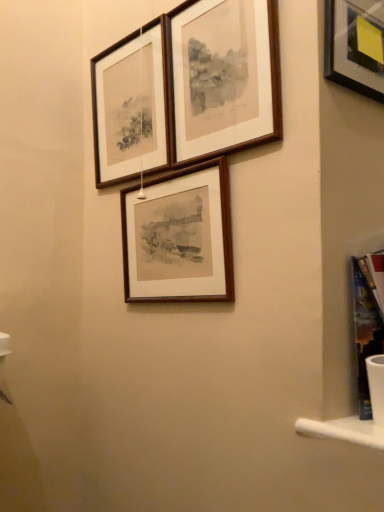
Question: Considering the relative sizes of wooden frame at center, the 3th picture frame positioned from the top, and wooden frame at upper center, which appears as the 1th picture frame when viewed from the top, in the image provided, is wooden frame at center, the 3th picture frame positioned from the top, wider than wooden frame at upper center, which appears as the 1th picture frame when viewed from the top,?

Choices:
 (A) no
 (B) yes

Answer: (B)

Question: From the image's perspective, is wooden frame at center, which is the 1th picture frame in bottom-to-top order, below wooden frame at upper center, which appears as the 1th picture frame when viewed from the top?

Choices:
 (A) yes
 (B) no

Answer: (A)

Question: Can you confirm if wooden frame at center, the 3th picture frame positioned from the top, is bigger than wooden frame at upper center, arranged as the third picture frame when ordered from the bottom?

Choices:
 (A) yes
 (B) no

Answer: (A)

Question: Is wooden frame at center, which is the 1th picture frame in bottom-to-top order, far away from wooden frame at upper center, which appears as the 1th picture frame when viewed from the top?

Choices:
 (A) no
 (B) yes

Answer: (A)

Question: Would you say wooden frame at upper center, which appears as the 1th picture frame when viewed from the top, is part of wooden frame at center, the 3th picture frame positioned from the top,'s contents?

Choices:
 (A) yes
 (B) no

Answer: (B)

Question: From a real-world perspective, is wooden frame at upper center, the 2th picture frame from the bottom, physically located above or below wooden frame at center, which is the 1th picture frame in bottom-to-top order?

Choices:
 (A) above
 (B) below

Answer: (A)

Question: Which is correct: wooden frame at upper center, the 2th picture frame when ordered from top to bottom, is inside wooden frame at center, the 3th picture frame positioned from the top, or outside of it?

Choices:
 (A) outside
 (B) inside

Answer: (A)

Question: Considering the positions of wooden frame at upper center, the 2th picture frame when ordered from top to bottom, and wooden frame at center, the 3th picture frame positioned from the top, in the image, is wooden frame at upper center, the 2th picture frame when ordered from top to bottom, bigger or smaller than wooden frame at center, the 3th picture frame positioned from the top,?

Choices:
 (A) small
 (B) big

Answer: (B)

Question: Considering the relative positions of wooden frame at upper center, the 2th picture frame when ordered from top to bottom, and wooden frame at center, which is the 1th picture frame in bottom-to-top order, in the image provided, is wooden frame at upper center, the 2th picture frame when ordered from top to bottom, to the left or to the right of wooden frame at center, which is the 1th picture frame in bottom-to-top order,?

Choices:
 (A) right
 (B) left

Answer: (B)

Question: Considering their positions, is wooden frame at upper center, arranged as the third picture frame when ordered from the bottom, located in front of or behind wooden frame at center, the 3th picture frame positioned from the top?

Choices:
 (A) behind
 (B) front

Answer: (B)

Question: In the image, is wooden frame at upper center, which appears as the 1th picture frame when viewed from the top, on the left side or the right side of wooden frame at center, the 3th picture frame positioned from the top?

Choices:
 (A) left
 (B) right

Answer: (B)

Question: From a real-world perspective, is wooden frame at upper center, arranged as the third picture frame when ordered from the bottom, above or below wooden frame at center, which is the 1th picture frame in bottom-to-top order?

Choices:
 (A) below
 (B) above

Answer: (B)

Question: Is wooden frame at upper center, which appears as the 1th picture frame when viewed from the top, inside or outside of wooden frame at center, which is the 1th picture frame in bottom-to-top order?

Choices:
 (A) inside
 (B) outside

Answer: (B)

Question: From the image's perspective, relative to wooden frame at upper center, the 2th picture frame when ordered from top to bottom, is wooden frame at center, which is the 1th picture frame in bottom-to-top order, above or below?

Choices:
 (A) below
 (B) above

Answer: (A)

Question: Looking at their shapes, would you say wooden frame at center, which is the 1th picture frame in bottom-to-top order, is wider or thinner than wooden frame at upper center, the 2th picture frame from the bottom?

Choices:
 (A) thin
 (B) wide

Answer: (B)